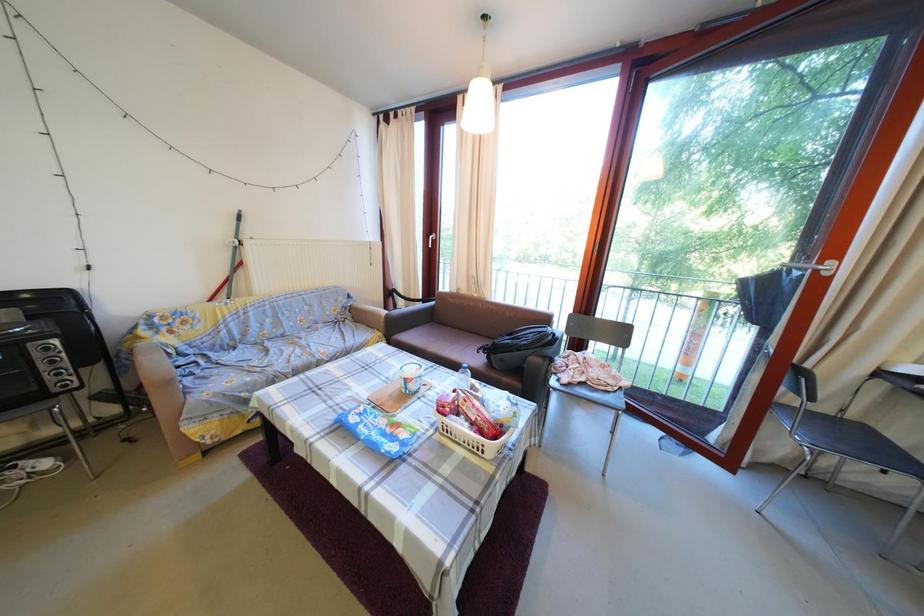
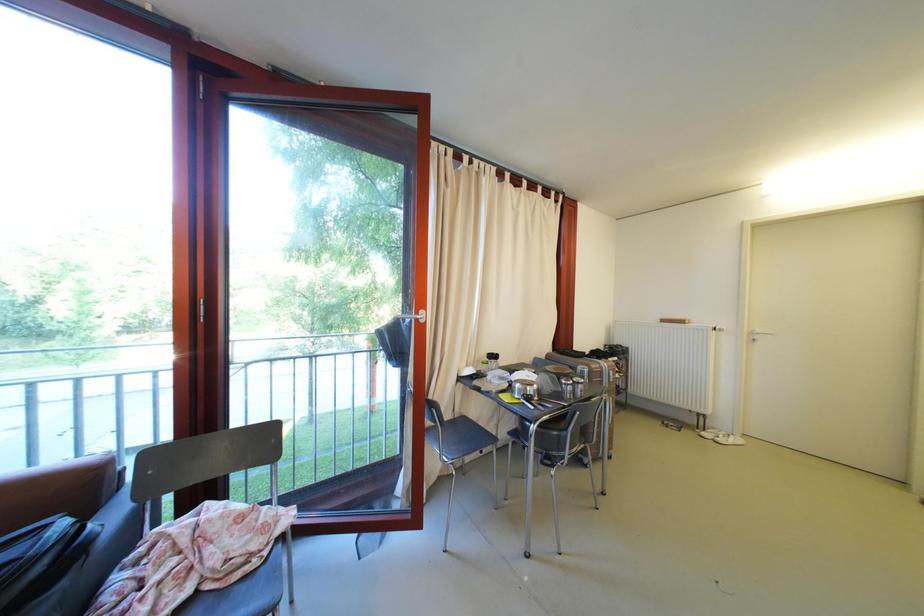
Question: The first image is from the beginning of the video and the second image is from the end. How did the camera likely rotate when shooting the video?

Choices:
 (A) Left
 (B) Right
 (C) Up
 (D) Down

Answer: (B)